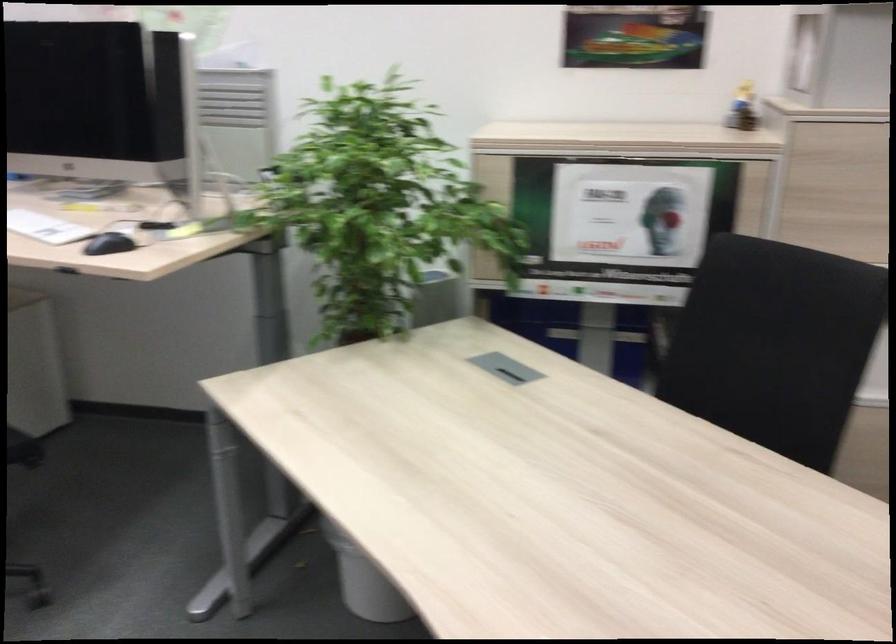
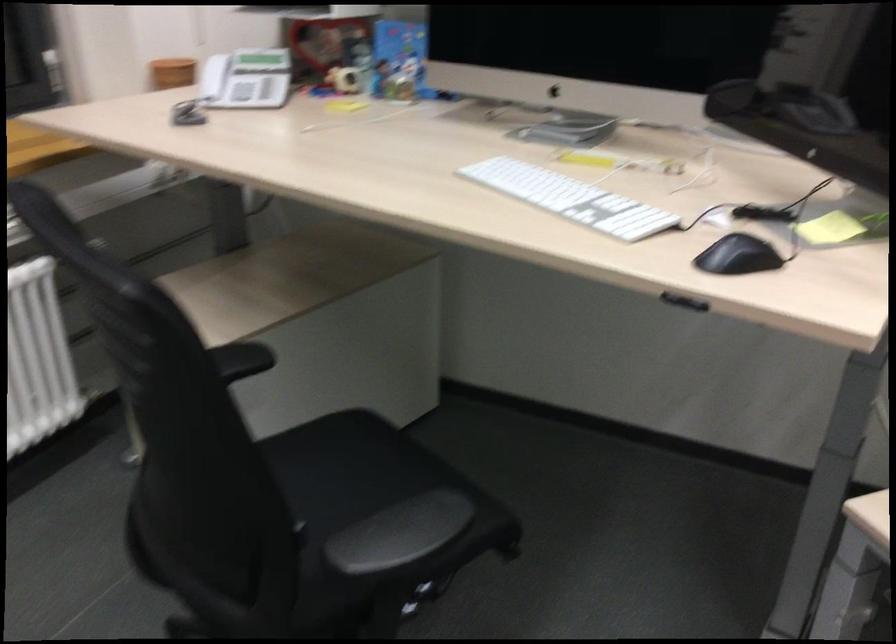
In the second image, find the point that corresponds to pixel 113 248 in the first image.

(737, 256)